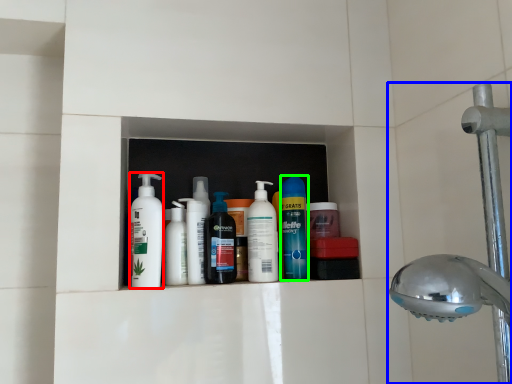
Question: Estimate the real-world distances between objects in this image. Which object is farther from cleaning product (highlighted by a red box), shower (highlighted by a blue box) or cleaning product (highlighted by a green box)?

Choices:
 (A) shower
 (B) cleaning product

Answer: (A)